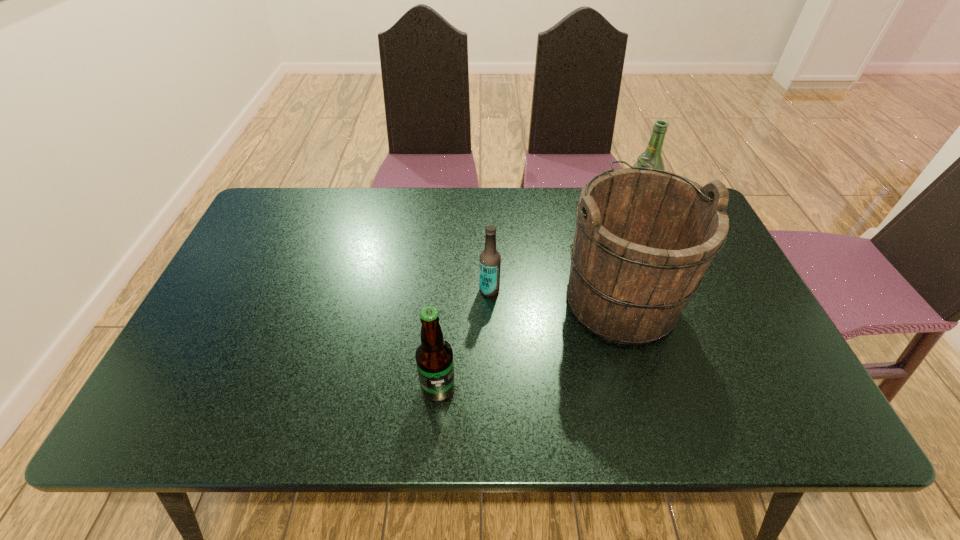
In the image, there is a desktop. At what (x,y) coordinates should I click in order to perform the action: click on vacant space at the near edge. Please return your answer as a coordinate pair (x, y). This screenshot has height=540, width=960. Looking at the image, I should click on (536, 431).

You are a GUI agent. You are given a task and a screenshot of the screen. Output one action in this format:
    pyautogui.click(x=<x>, y=<y>)
    Task: Click on the vacant region at the left edge of the desktop
    The width and height of the screenshot is (960, 540).
    Given the screenshot: What is the action you would take?
    pyautogui.click(x=200, y=388)

Identify the location of free location at the right edge of the desktop. (707, 309).

The image size is (960, 540). I want to click on free location at the far left corner, so click(274, 219).

In order to click on free region at the near left corner of the desktop in this screenshot , I will do `click(208, 397)`.

This screenshot has width=960, height=540. In order to click on free space between the tallest object and the leftmost beer bottle in this screenshot , I will do `click(529, 343)`.

You are a GUI agent. You are given a task and a screenshot of the screen. Output one action in this format:
    pyautogui.click(x=<x>, y=<y>)
    Task: Click on the free space between the nearest beer bottle and the rightmost beer bottle
    The height and width of the screenshot is (540, 960).
    Given the screenshot: What is the action you would take?
    pyautogui.click(x=538, y=298)

Image resolution: width=960 pixels, height=540 pixels. In order to click on free space between the rightmost beer bottle and the nearest beer bottle in this screenshot , I will do coord(538,298).

Locate an element on the screen. The height and width of the screenshot is (540, 960). free spot between the shortest object and the leftmost object is located at coordinates (464, 339).

The width and height of the screenshot is (960, 540). In order to click on vacant area between the second beer bottle from left to right and the leftmost object in this screenshot , I will do `click(464, 339)`.